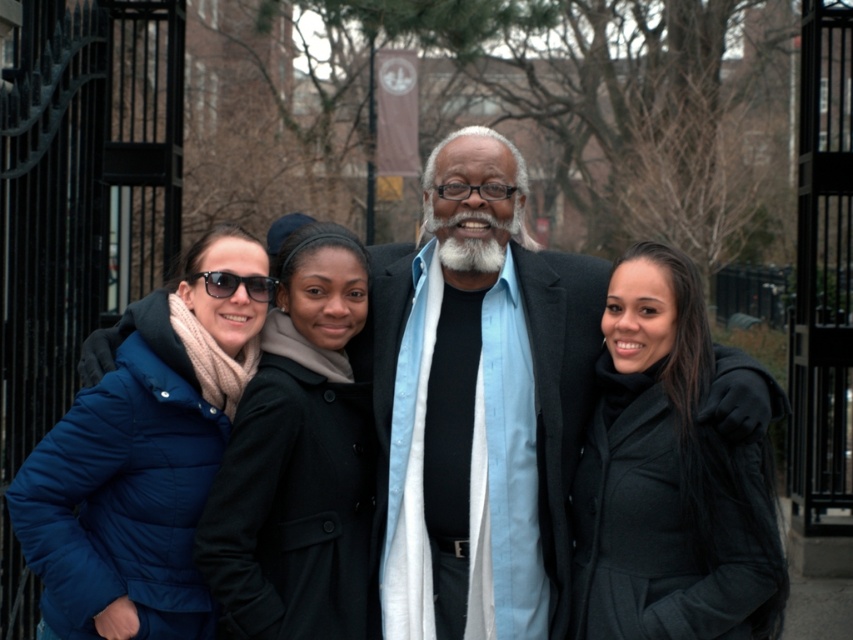
Who is taller, black wool coat at center or transparent plastic glasses at center?

black wool coat at center

Does black wool coat at center have a lesser width compared to transparent plastic glasses at center?

No, black wool coat at center is not thinner than transparent plastic glasses at center.

Does point (578, 468) lie behind point (483, 198)?

No, (578, 468) is closer to viewer.

Where is `black wool coat at center`? This screenshot has height=640, width=853. black wool coat at center is located at coordinates (666, 477).

Does light blue fabric shirt at center have a greater width compared to transparent plastic glasses at center?

Yes, light blue fabric shirt at center is wider than transparent plastic glasses at center.

Which is more to the right, light blue fabric shirt at center or transparent plastic glasses at center?

light blue fabric shirt at center

The width and height of the screenshot is (853, 640). Describe the element at coordinates (483, 397) in the screenshot. I see `light blue fabric shirt at center` at that location.

Where is `light blue fabric shirt at center`? This screenshot has width=853, height=640. light blue fabric shirt at center is located at coordinates (483, 397).

Looking at this image, does blue puffer jacket at left appear under white matte beard at center?

Indeed, blue puffer jacket at left is positioned under white matte beard at center.

Measure the distance between blue puffer jacket at left and white matte beard at center.

blue puffer jacket at left and white matte beard at center are 7.72 feet apart from each other.

The width and height of the screenshot is (853, 640). Identify the location of blue puffer jacket at left. (136, 474).